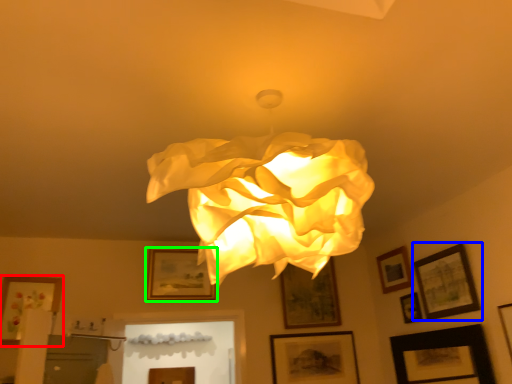
Question: Based on their relative distances, which object is nearer to picture frame (highlighted by a red box)? Choose from picture frame (highlighted by a blue box) and picture frame (highlighted by a green box).

Choices:
 (A) picture frame
 (B) picture frame

Answer: (B)